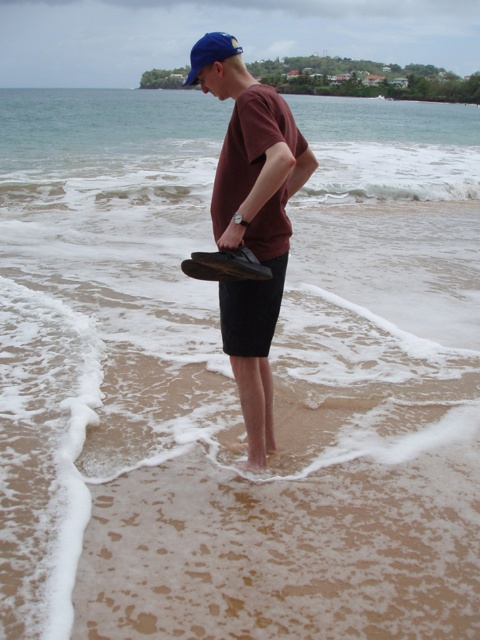
This screenshot has width=480, height=640. What do you see at coordinates (252, 220) in the screenshot?
I see `matte black shoe at center` at bounding box center [252, 220].

Is matte black shoe at center positioned at the back of blue fabric baseball cap at upper center?

No, it is not.

Image resolution: width=480 pixels, height=640 pixels. Describe the element at coordinates (252, 220) in the screenshot. I see `matte black shoe at center` at that location.

Locate an element on the screen. matte black shoe at center is located at coordinates (252, 220).